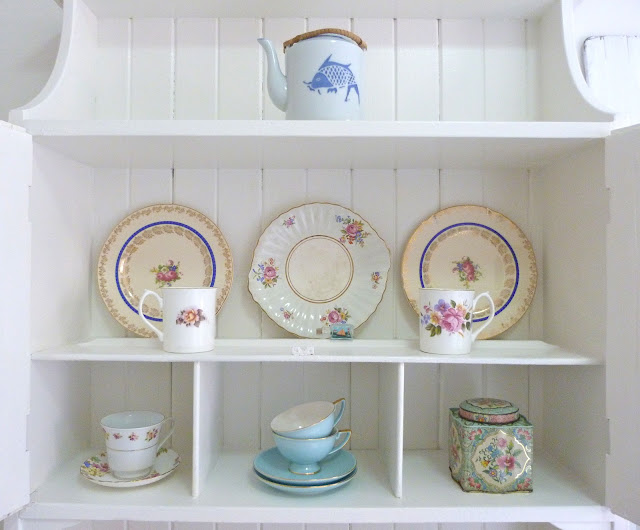
The width and height of the screenshot is (640, 530). Identify the location of white shelves. (339, 351), (324, 145), (372, 493).